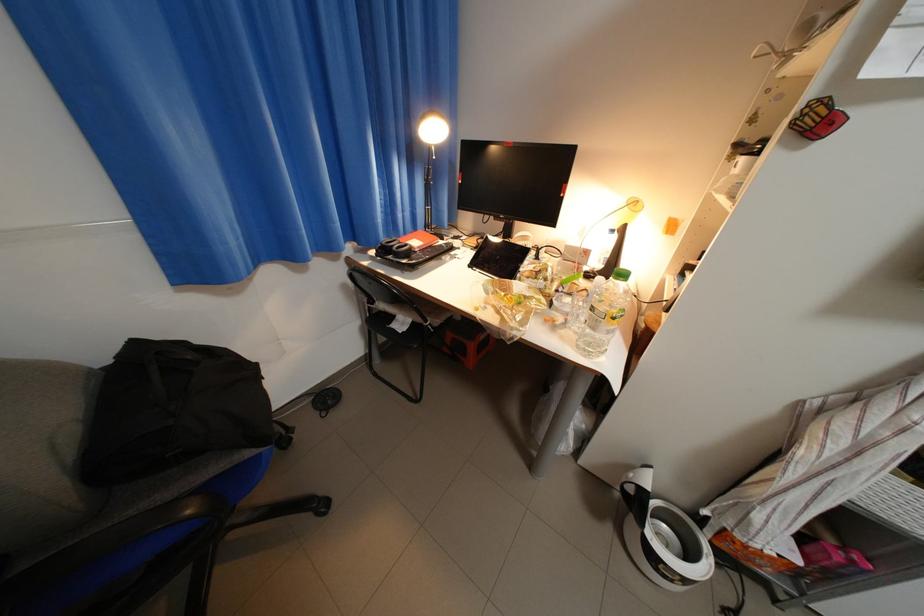
Where would you lift the red spiral notebook? Please return your answer as a coordinate pair (x, y).

(497, 257)